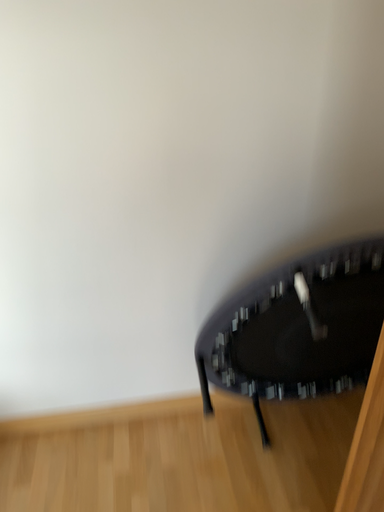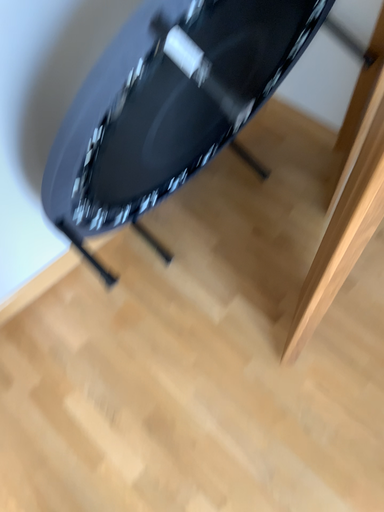
Question: How did the camera likely rotate when shooting the video?

Choices:
 (A) rotated right
 (B) rotated left

Answer: (A)